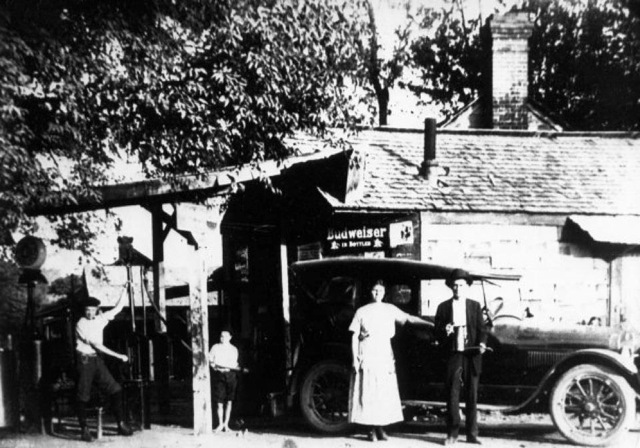
Where is `brick chimney`? This screenshot has height=448, width=640. brick chimney is located at coordinates (502, 99).